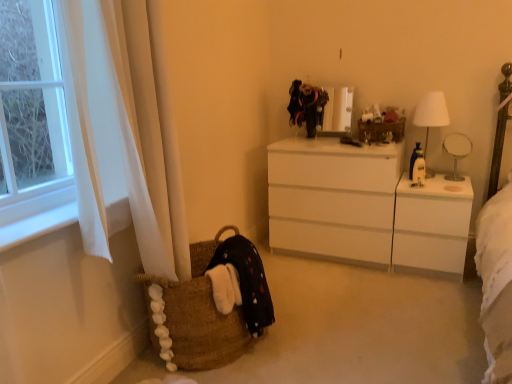
What are the coordinates of `free point in front of white glossy chest of drawers at center` in the screenshot? It's located at 365,297.